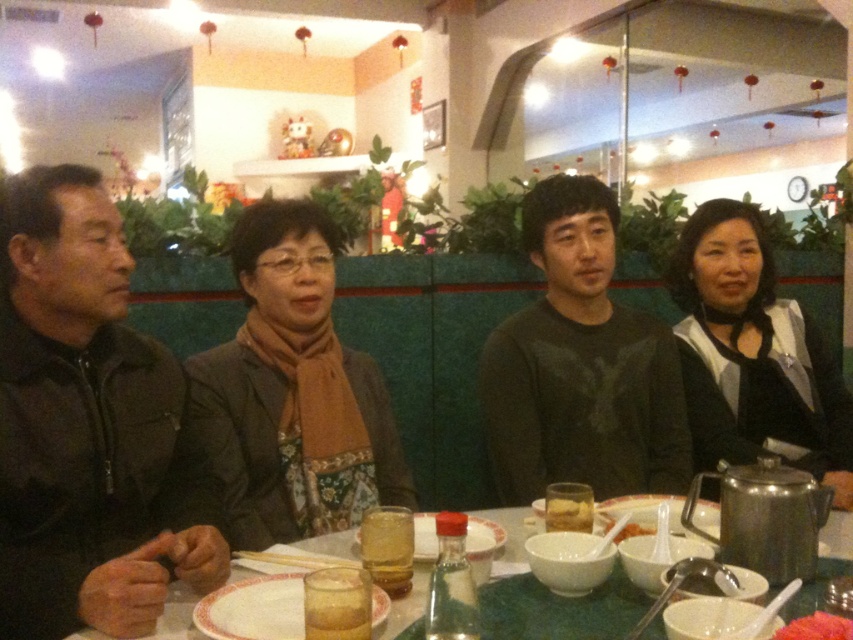
Based on the photo, who is more forward, [383,484] or [579,492]?

Point [579,492] is in front.

Between point (234, 365) and point (553, 497), which one is positioned in front?

Positioned in front is point (553, 497).

Find the location of `brown fabric scarf at center`. brown fabric scarf at center is located at coordinates click(x=293, y=392).

Between point (236, 448) and point (607, 529), which one is positioned behind?

The point (236, 448) is behind.

Locate an element on the screen. brown fabric scarf at center is located at coordinates (293, 392).

Identify the location of brown fabric scarf at center. (293, 392).

Is green marble table at center to the right of white matte rice bowl at center from the viewer's perspective?

Incorrect, green marble table at center is not on the right side of white matte rice bowl at center.

Can you confirm if green marble table at center is smaller than white matte rice bowl at center?

Incorrect, green marble table at center is not smaller in size than white matte rice bowl at center.

Is point (821, 538) positioned behind point (627, 525)?

That is True.

I want to click on green marble table at center, so click(x=177, y=616).